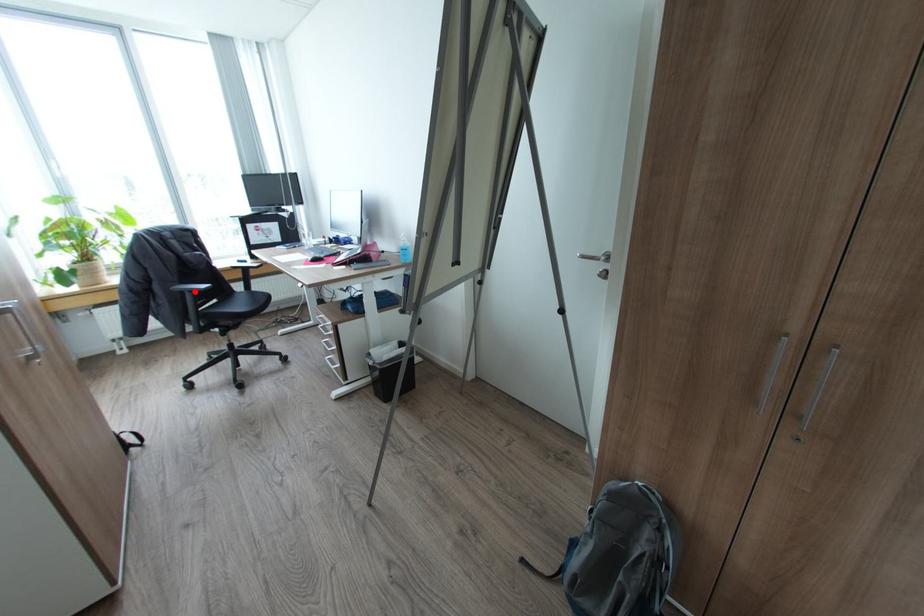
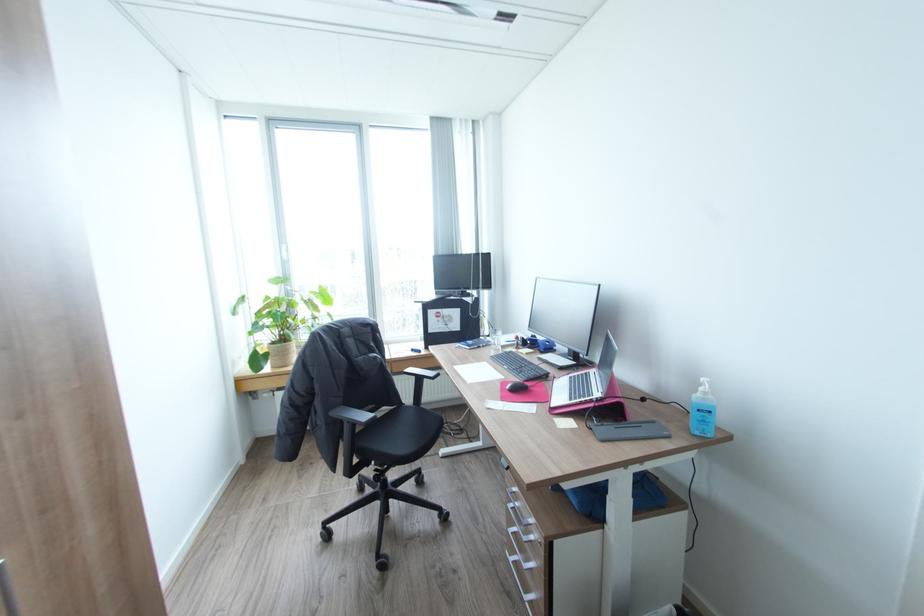
Question: I am providing you with two images of the same scene from different viewpoints. Given a red point in image1, look at the same physical point in image2. Is it:

Choices:
 (A) Closer to the viewpoint
 (B) Farther from the viewpoint

Answer: (A)